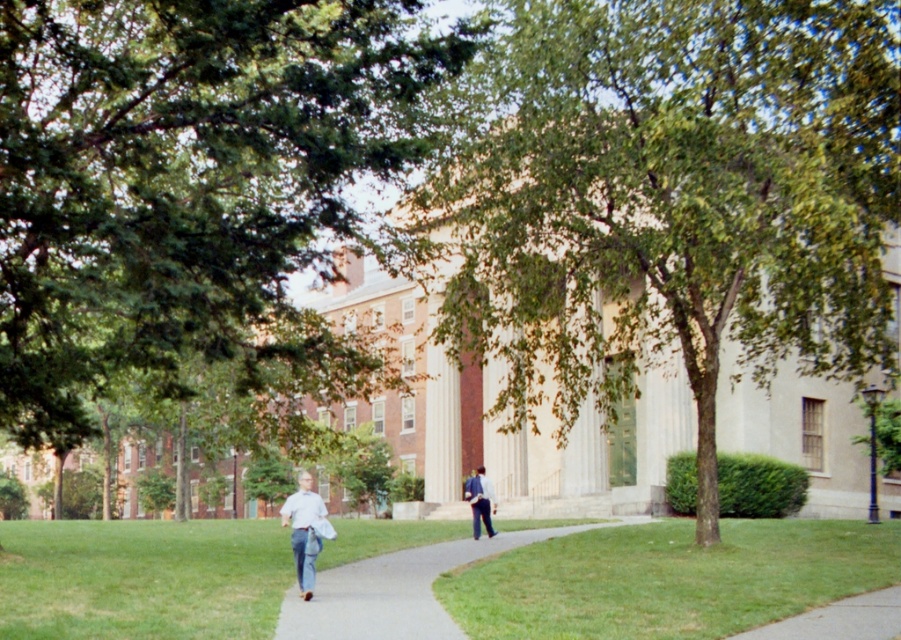
Question: Is green grass at center positioned behind gray concrete pavement at lower right?

Choices:
 (A) no
 (B) yes

Answer: (B)

Question: Can you confirm if green grass at center is positioned to the right of light blue denim jeans at center?

Choices:
 (A) no
 (B) yes

Answer: (B)

Question: Among these points, which one is farthest from the camera?

Choices:
 (A) (210, 230)
 (B) (490, 493)

Answer: (B)

Question: Among these objects, which one is nearest to the camera?

Choices:
 (A) gray concrete pavement at lower right
 (B) gray concrete sidewalk at center

Answer: (A)

Question: Is green leafy tree at center further to camera compared to gray concrete pavement at lower right?

Choices:
 (A) no
 (B) yes

Answer: (B)

Question: Which point is farther from the camera taking this photo?

Choices:
 (A) (520, 568)
 (B) (175, 209)
 (C) (504, 72)
 (D) (469, 497)

Answer: (D)